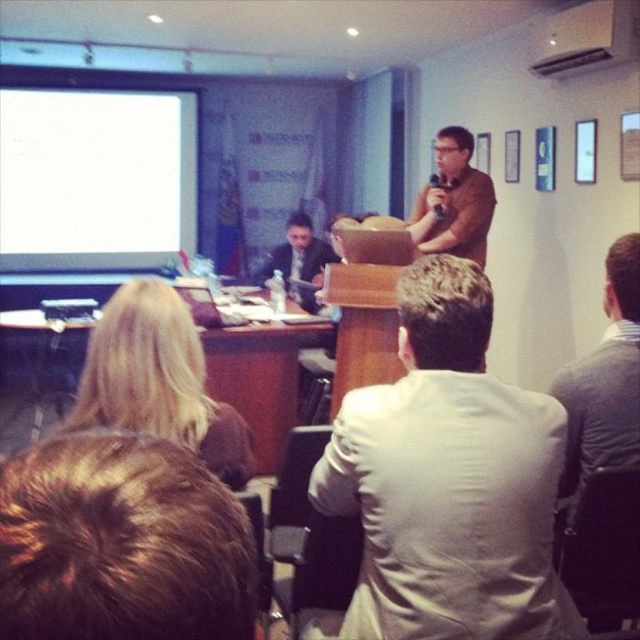
Which of these two, white fabric suit at center or black plastic projector at lower left, stands shorter?

With less height is black plastic projector at lower left.

Does white fabric suit at center have a larger size compared to black plastic projector at lower left?

Indeed, white fabric suit at center has a larger size compared to black plastic projector at lower left.

Between point (465, 266) and point (52, 305), which one is positioned in front?

Point (465, 266) is more forward.

The height and width of the screenshot is (640, 640). I want to click on white fabric suit at center, so click(x=449, y=480).

Consider the image. Which is above, white matte projection screen at upper left or brown shirt at upper center?

white matte projection screen at upper left is higher up.

Does white matte projection screen at upper left appear on the right side of brown shirt at upper center?

In fact, white matte projection screen at upper left is to the left of brown shirt at upper center.

The image size is (640, 640). What are the coordinates of `white matte projection screen at upper left` in the screenshot? It's located at (96, 179).

This screenshot has height=640, width=640. Find the location of `white matte projection screen at upper left`. white matte projection screen at upper left is located at coordinates (96, 179).

Can you confirm if matte black suit at center is smaller than black plastic projector at lower left?

No.

Does matte black suit at center appear on the right side of black plastic projector at lower left?

Indeed, matte black suit at center is positioned on the right side of black plastic projector at lower left.

Between point (308, 260) and point (51, 314), which one is positioned in front?

Positioned in front is point (51, 314).

I want to click on matte black suit at center, so click(x=300, y=260).